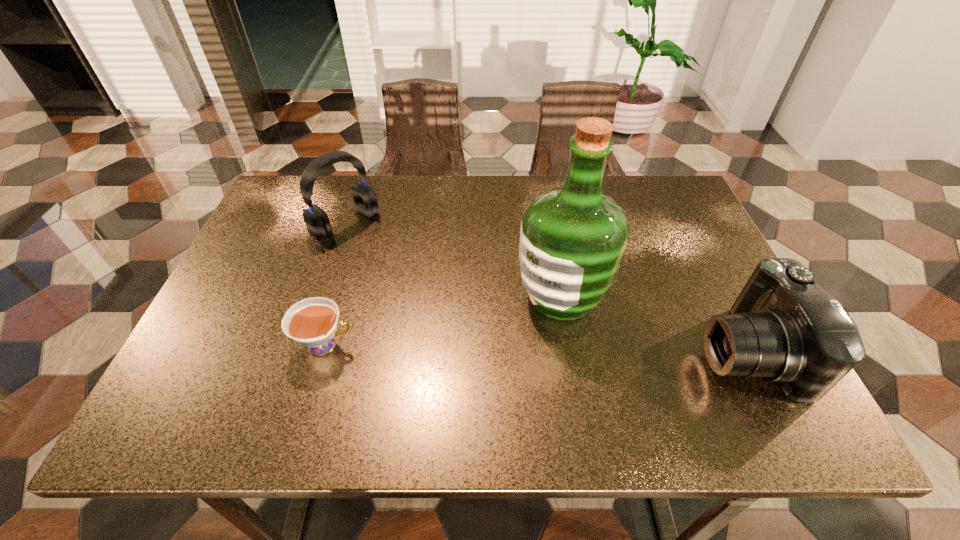
This screenshot has width=960, height=540. I want to click on free space located 0.380m on the lens of the camera, so click(x=520, y=350).

At what (x,y) coordinates should I click in order to perform the action: click on free space located 0.310m on the headband of the second tallest object. Please return your answer as a coordinate pair (x, y). Image resolution: width=960 pixels, height=540 pixels. Looking at the image, I should click on (444, 301).

Find the location of `free space located on the headband of the second tallest object`. free space located on the headband of the second tallest object is located at coordinates (438, 296).

The height and width of the screenshot is (540, 960). I want to click on free region located 0.240m on the headband of the second tallest object, so click(x=423, y=286).

This screenshot has height=540, width=960. I want to click on free location located on the front-facing side of the tallest object, so click(x=417, y=379).

You are a GUI agent. You are given a task and a screenshot of the screen. Output one action in this format:
    pyautogui.click(x=<x>, y=<y>)
    Task: Click on the vacant area situated on the front-facing side of the tallest object
    This screenshot has width=960, height=540.
    Given the screenshot: What is the action you would take?
    pyautogui.click(x=508, y=328)

Locate an element on the screen. The image size is (960, 540). vacant space located 0.190m on the front-facing side of the tallest object is located at coordinates (454, 358).

Where is `object that is positioned at the far edge`? The height and width of the screenshot is (540, 960). object that is positioned at the far edge is located at coordinates (317, 221).

The width and height of the screenshot is (960, 540). I want to click on teacup situated at the near edge, so click(312, 322).

What are the coordinates of `camera at the near edge` in the screenshot? It's located at (784, 328).